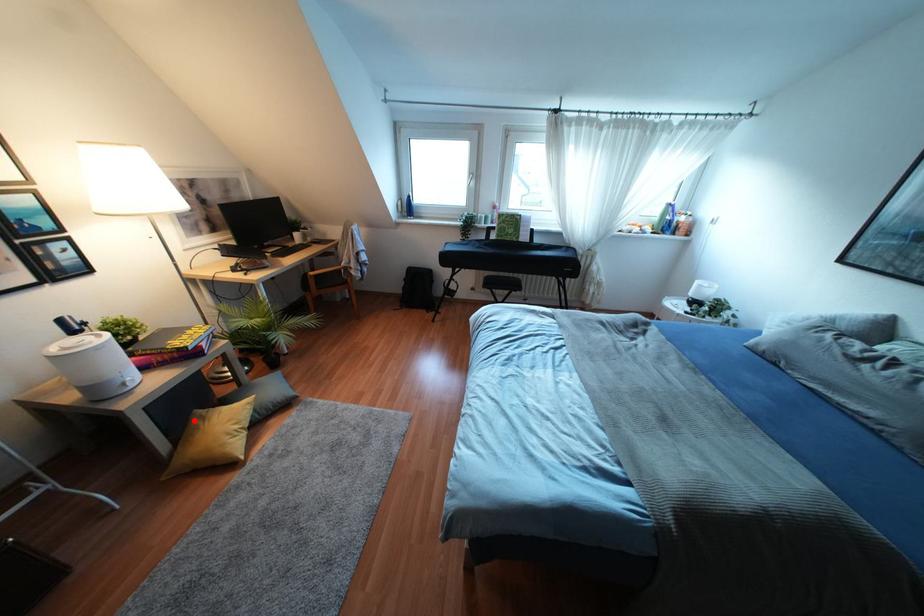
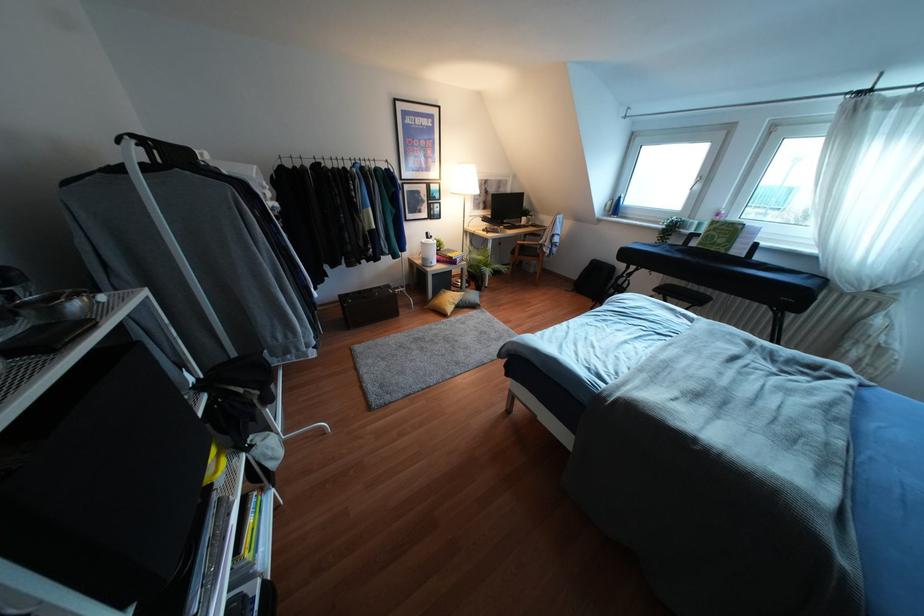
In the second image, find the point that corresponds to the highlighted location in the first image.

(441, 292)